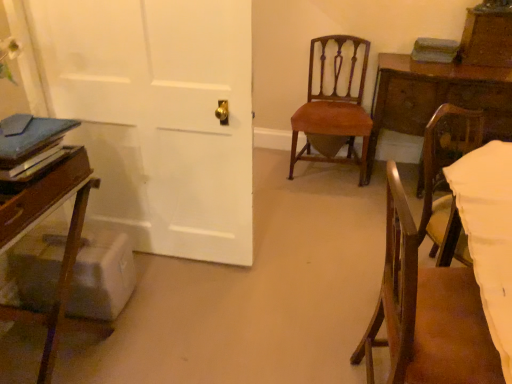
Question: Which direction should I rotate to face velvet orange chair at center, which ranks as the second chair in left-to-right order, — up or down?

Choices:
 (A) up
 (B) down

Answer: (A)

Question: Is wooden table at right at the back of velvet orange chair at center, arranged as the 3th chair when viewed from the front?

Choices:
 (A) yes
 (B) no

Answer: (B)

Question: Could you tell me if velvet orange chair at center, arranged as the 3th chair when viewed from the front, is turned towards wooden table at right?

Choices:
 (A) no
 (B) yes

Answer: (A)

Question: Is velvet orange chair at center, arranged as the 3th chair when viewed from the front, wider than wooden table at right?

Choices:
 (A) yes
 (B) no

Answer: (B)

Question: Considering the relative sizes of velvet orange chair at center, the first chair when ordered from back to front, and wooden table at right in the image provided, is velvet orange chair at center, the first chair when ordered from back to front, thinner than wooden table at right?

Choices:
 (A) no
 (B) yes

Answer: (B)

Question: Is velvet orange chair at center, arranged as the 3th chair when viewed from the front, further to the viewer compared to wooden table at right?

Choices:
 (A) no
 (B) yes

Answer: (B)

Question: Does velvet orange chair at center, arranged as the 3th chair when viewed from the front, appear on the left side of wooden table at right?

Choices:
 (A) no
 (B) yes

Answer: (B)

Question: Is wooden chair at left, the 3th chair viewed from the right, completely or partially inside wooden chair at lower right, the 3th chair viewed from the back?

Choices:
 (A) no
 (B) yes

Answer: (A)

Question: Considering the relative sizes of wooden chair at lower right, the 3th chair viewed from the back, and wooden chair at left, the second chair in the front-to-back sequence, in the image provided, is wooden chair at lower right, the 3th chair viewed from the back, shorter than wooden chair at left, the second chair in the front-to-back sequence,?

Choices:
 (A) no
 (B) yes

Answer: (A)

Question: Can you confirm if wooden chair at lower right, marked as the third chair in a left-to-right arrangement, is smaller than wooden chair at left, the 3th chair viewed from the right?

Choices:
 (A) no
 (B) yes

Answer: (B)

Question: Is the position of wooden chair at lower right, marked as the 1th chair in a front-to-back arrangement, less distant than that of wooden chair at left, positioned as the second chair in back-to-front order?

Choices:
 (A) yes
 (B) no

Answer: (A)

Question: Is wooden chair at lower right, marked as the 1th chair in a front-to-back arrangement, next to wooden chair at left, positioned as the second chair in back-to-front order?

Choices:
 (A) yes
 (B) no

Answer: (B)

Question: Considering the relative sizes of wooden chair at lower right, which is the first chair in right-to-left order, and wooden chair at left, the second chair in the front-to-back sequence, in the image provided, is wooden chair at lower right, which is the first chair in right-to-left order, wider than wooden chair at left, the second chair in the front-to-back sequence,?

Choices:
 (A) no
 (B) yes

Answer: (A)

Question: From the image's perspective, is wooden chair at lower right, marked as the third chair in a left-to-right arrangement, above velvet orange chair at center, the first chair when ordered from back to front?

Choices:
 (A) yes
 (B) no

Answer: (B)